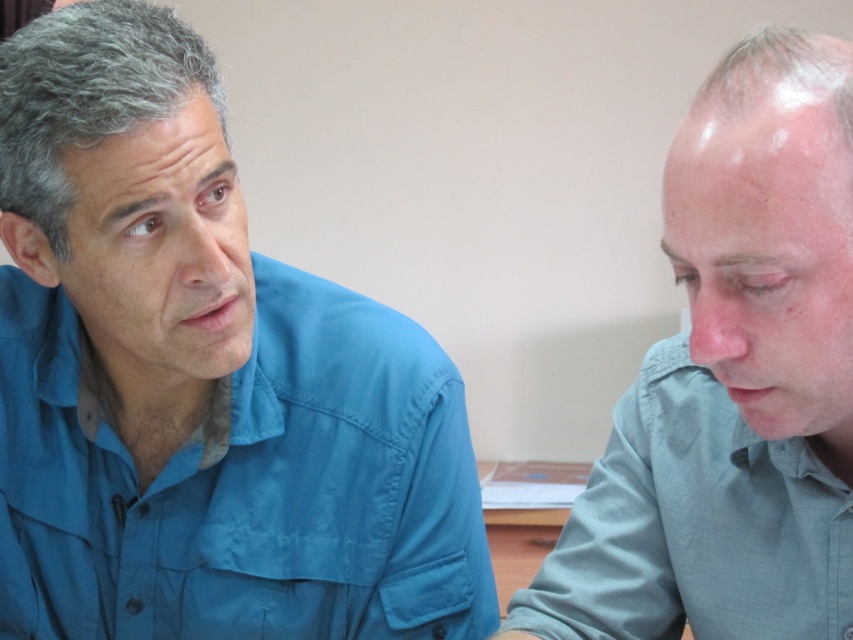
Question: Among these points, which one is nearest to the camera?

Choices:
 (A) (610, 500)
 (B) (653, 387)
 (C) (0, 339)

Answer: (B)

Question: Which object is closer to the camera taking this photo?

Choices:
 (A) gray matte shirt at right
 (B) light blue cotton shirt at right
 (C) blue fabric shirt at left

Answer: (A)

Question: Is blue fabric shirt at left bigger than light blue cotton shirt at right?

Choices:
 (A) yes
 (B) no

Answer: (A)

Question: Can you confirm if blue fabric shirt at left is thinner than gray matte shirt at right?

Choices:
 (A) no
 (B) yes

Answer: (A)

Question: Can you confirm if blue fabric shirt at left is wider than light blue cotton shirt at right?

Choices:
 (A) yes
 (B) no

Answer: (A)

Question: Which object appears closest to the camera in this image?

Choices:
 (A) gray matte shirt at right
 (B) light blue cotton shirt at right
 (C) blue fabric shirt at left

Answer: (A)